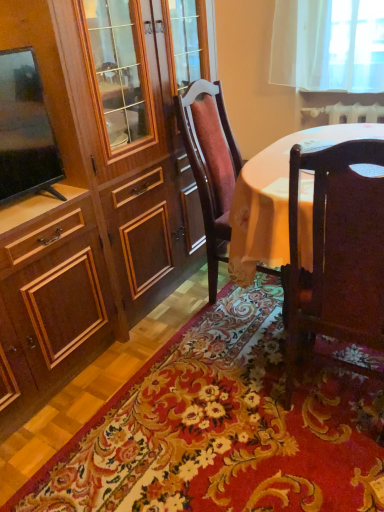
Question: Is wooden chair at center, placed as the 1th chair when sorted from back to front, inside the boundaries of floral carpet at center, or outside?

Choices:
 (A) outside
 (B) inside

Answer: (A)

Question: Is wooden chair at center, placed as the 1th chair when sorted from back to front, bigger or smaller than floral carpet at center?

Choices:
 (A) big
 (B) small

Answer: (A)

Question: Considering the real-world distances, which object is farthest from the matte black tv at left?

Choices:
 (A) dark wood chair at lower right, arranged as the 2th chair when viewed from the back
 (B) wooden chair at center, which ranks as the 2th chair in front-to-back order
 (C) floral carpet at center

Answer: (C)

Question: Considering the real-world distances, which object is closest to the matte black tv at left?

Choices:
 (A) wooden chair at center, which ranks as the 2th chair in front-to-back order
 (B) dark wood chair at lower right, the first chair from the front
 (C) floral carpet at center

Answer: (A)